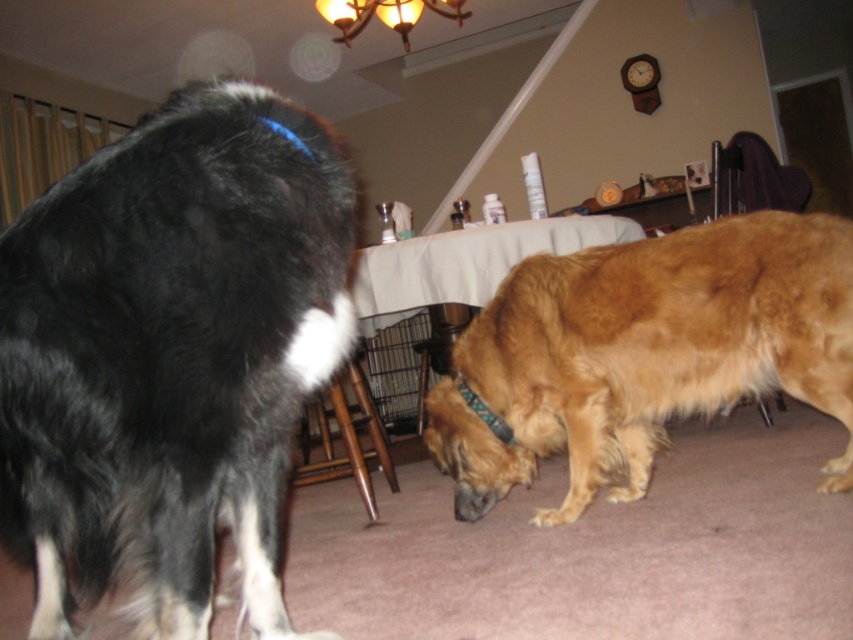
Question: Where is black fluffy dog at left located in relation to golden fur dog at lower right in the image?

Choices:
 (A) below
 (B) above

Answer: (A)

Question: Is black fluffy dog at left positioned at the back of golden fur dog at lower right?

Choices:
 (A) yes
 (B) no

Answer: (B)

Question: Does black fluffy dog at left appear over golden fur dog at lower right?

Choices:
 (A) yes
 (B) no

Answer: (B)

Question: Among these points, which one is nearest to the camera?

Choices:
 (A) tap(341, 273)
 (B) tap(468, 464)

Answer: (A)